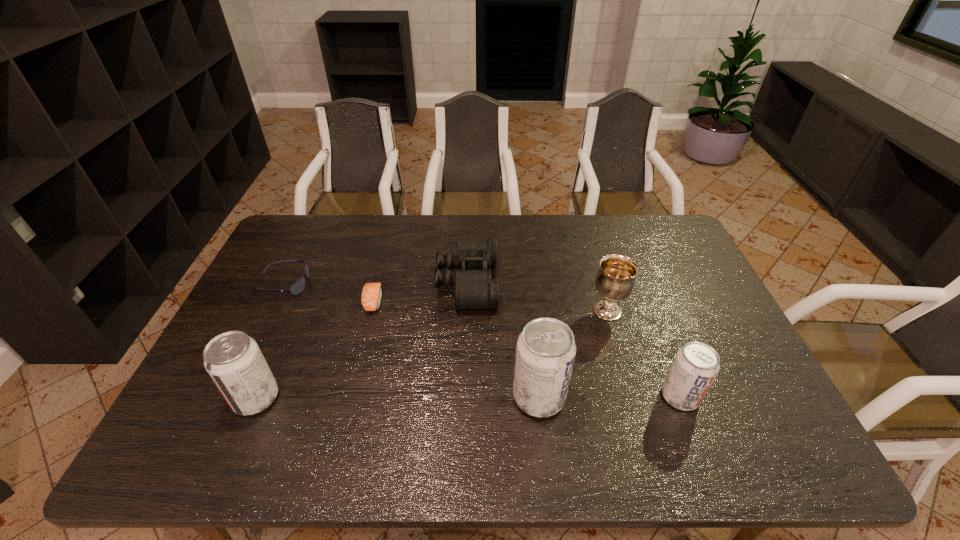
Please point a location where one more pop_(soda) can be added evenly. Please provide its 2D coordinates. Your answer should be formatted as a tuple, i.e. [(x, y)], where the tuple contains the x and y coordinates of a point satisfying the conditions above.

[(397, 397)]